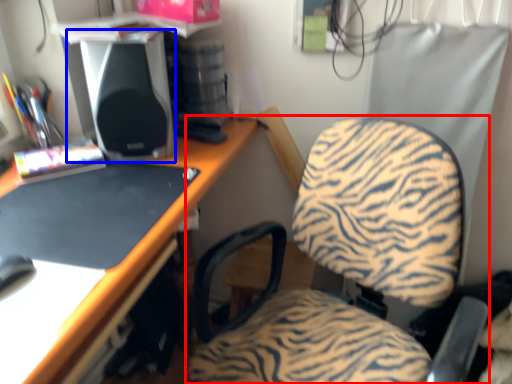
Question: Which object appears farthest to the camera in this image, chair (highlighted by a red box) or speaker (highlighted by a blue box)?

Choices:
 (A) chair
 (B) speaker

Answer: (B)